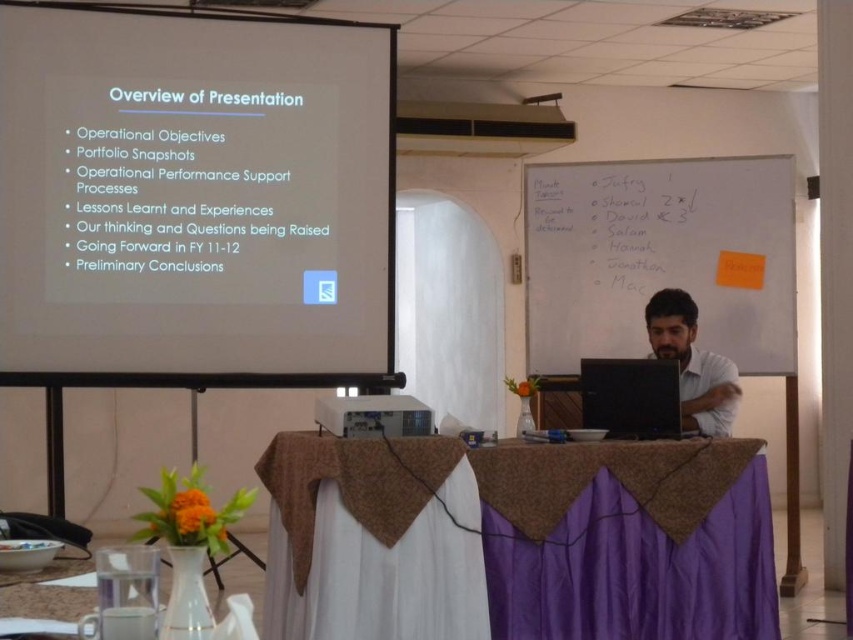
Question: Can you confirm if white matte projector screen at upper center is positioned below whiteboard at upper right?

Choices:
 (A) yes
 (B) no

Answer: (B)

Question: Which is farther from the whiteboard at upper right?

Choices:
 (A) purple fabric-covered table at center
 (B) black glossy laptop at center
 (C) white matte projector screen at upper center

Answer: (A)

Question: Which object is closer to the camera taking this photo?

Choices:
 (A) whiteboard at upper right
 (B) purple fabric-covered table at center
 (C) matte white shirt at right

Answer: (B)

Question: Which point appears farthest from the camera in this image?

Choices:
 (A) 306,138
 (B) 668,470
 (C) 415,410
 (D) 763,369

Answer: (D)

Question: Is whiteboard at upper right positioned in front of matte white shirt at right?

Choices:
 (A) no
 (B) yes

Answer: (A)

Question: Is whiteboard at upper right to the left of black glossy laptop at center from the viewer's perspective?

Choices:
 (A) no
 (B) yes

Answer: (A)